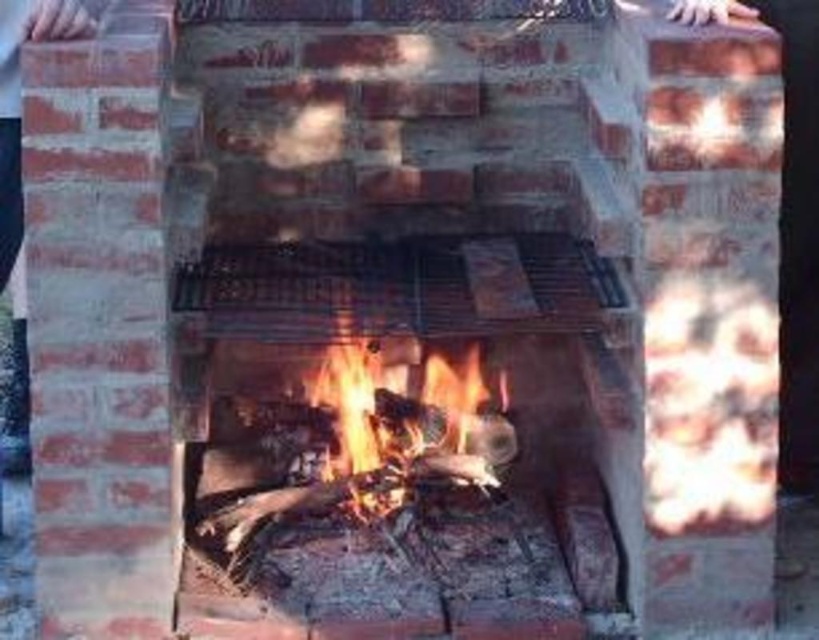
Question: In this image, where is black metal grill at center located relative to flaming wood at center?

Choices:
 (A) above
 (B) below

Answer: (A)

Question: Can you confirm if black metal grill at center is positioned above flaming wood at center?

Choices:
 (A) yes
 (B) no

Answer: (A)

Question: Which point is farther from the camera taking this photo?

Choices:
 (A) (292, 276)
 (B) (345, 476)

Answer: (B)

Question: Which point appears closest to the camera in this image?

Choices:
 (A) (464, 422)
 (B) (345, 243)

Answer: (B)

Question: Can you confirm if black metal grill at center is positioned to the left of flaming wood at center?

Choices:
 (A) no
 (B) yes

Answer: (B)

Question: Which point is closer to the camera taking this photo?

Choices:
 (A) coord(580,296)
 (B) coord(458,381)

Answer: (A)